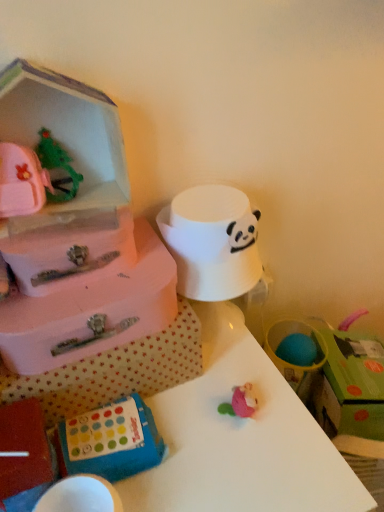
The image size is (384, 512). Describe the element at coordinates (213, 387) in the screenshot. I see `white glossy table at center` at that location.

Locate an element on the screen. The width and height of the screenshot is (384, 512). blue rubbery toy at lower center is located at coordinates [111, 441].

From the picture: Can you confirm if blue rubbery toy at lower center is smaller than white glossy table at center?

Yes, blue rubbery toy at lower center is smaller than white glossy table at center.

Measure the distance between blue rubbery toy at lower center and white glossy table at center.

They are 4.83 inches apart.

Can you confirm if blue rubbery toy at lower center is wider than white glossy table at center?

No, blue rubbery toy at lower center is not wider than white glossy table at center.

Is blue rubbery toy at lower center taller or shorter than white glossy table at center?

blue rubbery toy at lower center is shorter than white glossy table at center.

From the image's perspective, relative to white glossy table at center, is green cardboard box at upper right above or below?

Clearly, from the image's perspective, green cardboard box at upper right is above white glossy table at center.

Find the location of `table in front of the green cardboard box at upper right`. table in front of the green cardboard box at upper right is located at coordinates (213, 387).

Is green cardboard box at upper right located outside white glossy table at center?

That's correct, green cardboard box at upper right is outside of white glossy table at center.

Is the position of green cardboard box at upper right less distant than that of white glossy table at center?

No.

Can you confirm if green cardboard box at upper right is wider than blue rubbery toy at lower center?

Correct, the width of green cardboard box at upper right exceeds that of blue rubbery toy at lower center.

Is green cardboard box at upper right oriented away from blue rubbery toy at lower center?

No, green cardboard box at upper right's orientation is not away from blue rubbery toy at lower center.

Which of these two, green cardboard box at upper right or blue rubbery toy at lower center, is bigger?

With larger size is green cardboard box at upper right.

Is white glossy table at center not inside blue rubbery toy at lower center?

Yes, white glossy table at center is located beyond the bounds of blue rubbery toy at lower center.

Which is more to the left, white glossy table at center or blue rubbery toy at lower center?

blue rubbery toy at lower center.

Does point (7, 402) come farther from viewer compared to point (130, 456)?

No, (7, 402) is in front of (130, 456).

Is white glossy table at center not near blue rubbery toy at lower center?

No, white glossy table at center is not far away from blue rubbery toy at lower center.

From the picture: Does blue rubbery toy at lower center come in front of green cardboard box at upper right?

Yes, blue rubbery toy at lower center is in front of green cardboard box at upper right.

Considering the relative positions of blue rubbery toy at lower center and green cardboard box at upper right in the image provided, is blue rubbery toy at lower center to the right of green cardboard box at upper right from the viewer's perspective?

No, blue rubbery toy at lower center is not to the right of green cardboard box at upper right.

Is point (142, 447) positioned in front of point (343, 424)?

Yes, it is in front of point (343, 424).

From a real-world perspective, which is physically below, blue rubbery toy at lower center or green cardboard box at upper right?

From a 3D spatial view, green cardboard box at upper right is below.

From a real-world perspective, is white glossy table at center positioned above or below green cardboard box at upper right?

Clearly, from a real-world perspective, white glossy table at center is below green cardboard box at upper right.

You are a GUI agent. You are given a task and a screenshot of the screen. Output one action in this format:
    pyautogui.click(x=<x>, y=<y>)
    Task: Click on the table that is below the green cardboard box at upper right (from the image's perspective)
    
    Given the screenshot: What is the action you would take?
    pyautogui.click(x=213, y=387)

Is white glossy table at center located outside green cardboard box at upper right?

white glossy table at center lies outside green cardboard box at upper right's area.

Where is `table on the right of blue rubbery toy at lower center`? table on the right of blue rubbery toy at lower center is located at coordinates (213, 387).

Identify the location of table located on the left of green cardboard box at upper right. [x=213, y=387].

Estimate the real-world distances between objects in this image. Which object is further from white glossy table at center, green cardboard box at upper right or blue rubbery toy at lower center?

Based on the image, green cardboard box at upper right appears to be further to white glossy table at center.

Which object lies further to the anchor point white glossy table at center, blue rubbery toy at lower center or green cardboard box at upper right?

green cardboard box at upper right.

Which object lies further to the anchor point green cardboard box at upper right, blue rubbery toy at lower center or white glossy table at center?

blue rubbery toy at lower center.

From the image, which object appears to be farther from blue rubbery toy at lower center, green cardboard box at upper right or white glossy table at center?

green cardboard box at upper right lies further to blue rubbery toy at lower center than the other object.

Based on their spatial positions, is white glossy table at center or green cardboard box at upper right closer to blue rubbery toy at lower center?

white glossy table at center lies closer to blue rubbery toy at lower center than the other object.

When comparing their distances from green cardboard box at upper right, does white glossy table at center or blue rubbery toy at lower center seem closer?

Based on the image, white glossy table at center appears to be nearer to green cardboard box at upper right.

You are a GUI agent. You are given a task and a screenshot of the screen. Output one action in this format:
    pyautogui.click(x=<x>, y=<y>)
    Task: Click on the table between blue rubbery toy at lower center and green cardboard box at upper right from left to right
    
    Given the screenshot: What is the action you would take?
    pyautogui.click(x=213, y=387)